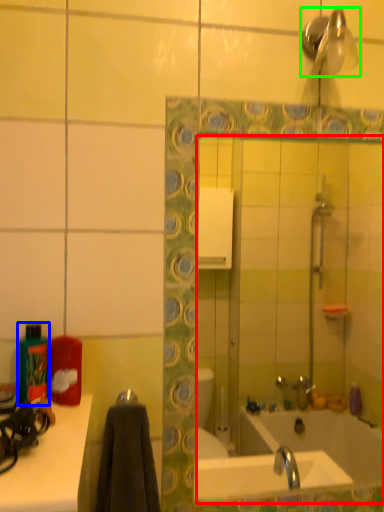
Question: Which is nearer to the mirror (highlighted by a red box)? bottle (highlighted by a blue box) or shower (highlighted by a green box).

Choices:
 (A) bottle
 (B) shower

Answer: (B)